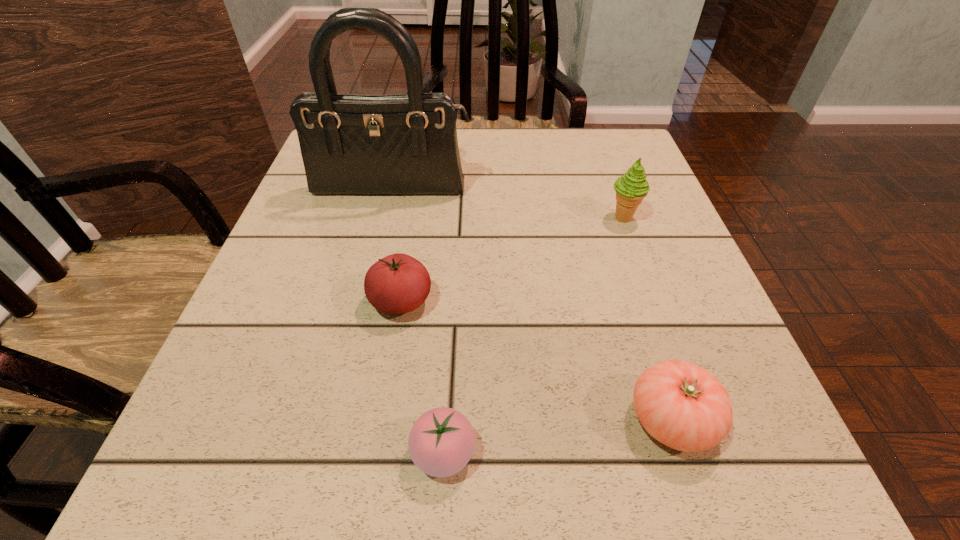
The height and width of the screenshot is (540, 960). Find the location of `vacant area that lies between the rightmost tomato and the farthest tomato`. vacant area that lies between the rightmost tomato and the farthest tomato is located at coordinates (536, 361).

This screenshot has height=540, width=960. I want to click on object that is the closest one to the handbag, so click(x=398, y=283).

At what (x,y) coordinates should I click in order to perform the action: click on object that stands as the closest to the third nearest object. Please return your answer as a coordinate pair (x, y). This screenshot has width=960, height=540. Looking at the image, I should click on (441, 442).

Where is `tomato identified as the second closest to the rightmost tomato`? tomato identified as the second closest to the rightmost tomato is located at coordinates (398, 283).

Identify which tomato is located as the third nearest to the farthest object. Please provide its 2D coordinates. Your answer should be formatted as a tuple, i.e. [(x, y)], where the tuple contains the x and y coordinates of a point satisfying the conditions above.

[(441, 442)]

The width and height of the screenshot is (960, 540). I want to click on free space that satisfies the following two spatial constraints: 1. on the back side of the second tallest object; 2. on the left side of the rightmost tomato, so click(607, 218).

At what (x,y) coordinates should I click in order to perform the action: click on vacant region that satisfies the following two spatial constraints: 1. on the front side of the third farthest object; 2. on the left side of the rightmost tomato. Please return your answer as a coordinate pair (x, y). The width and height of the screenshot is (960, 540). Looking at the image, I should click on (381, 420).

Where is `free spot that satisfies the following two spatial constraints: 1. on the back side of the icecream; 2. on the right side of the third farthest object`? The image size is (960, 540). free spot that satisfies the following two spatial constraints: 1. on the back side of the icecream; 2. on the right side of the third farthest object is located at coordinates (415, 218).

Locate an element on the screen. free space that satisfies the following two spatial constraints: 1. with an open clasp on the front of the tallest object; 2. on the left side of the rightmost tomato is located at coordinates point(337,420).

Locate an element on the screen. The image size is (960, 540). free point that satisfies the following two spatial constraints: 1. with an open clasp on the front of the farthest tomato; 2. on the right side of the farthest object is located at coordinates coord(366,301).